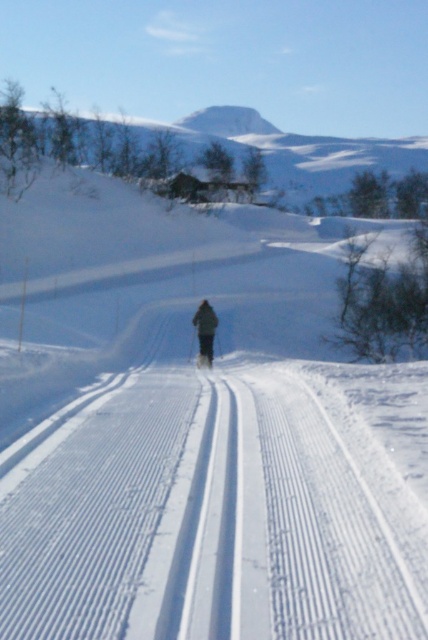
Can you confirm if dark green fabric at center is positioned above white matte ski at center?

Yes, dark green fabric at center is above white matte ski at center.

Does point (198, 312) lie in front of point (211, 364)?

Yes, it is in front of point (211, 364).

Is point (207, 308) farther from viewer compared to point (205, 360)?

Yes.

At what (x,y) coordinates should I click in order to perform the action: click on dark green fabric at center. Please return your answer as a coordinate pair (x, y). The width and height of the screenshot is (428, 640). Looking at the image, I should click on (205, 330).